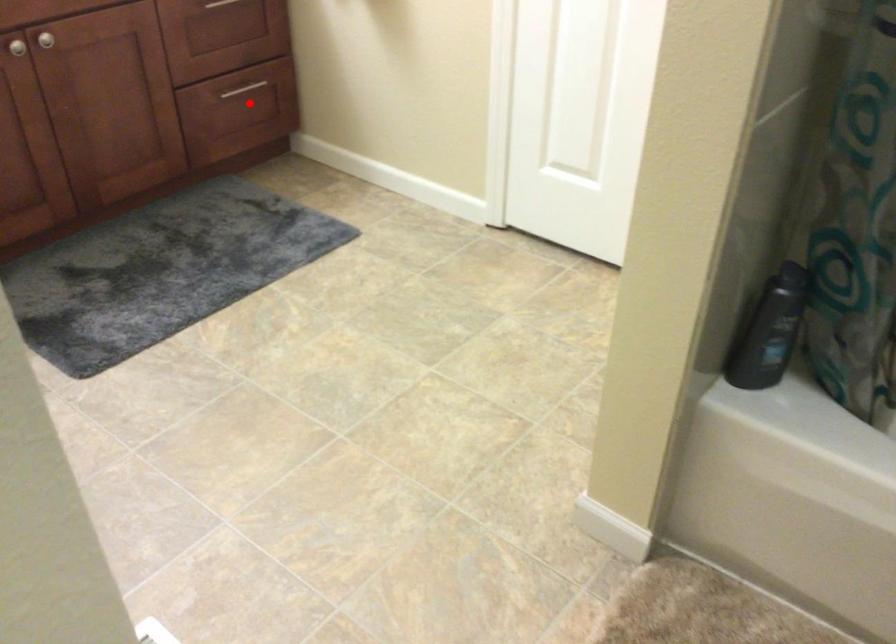
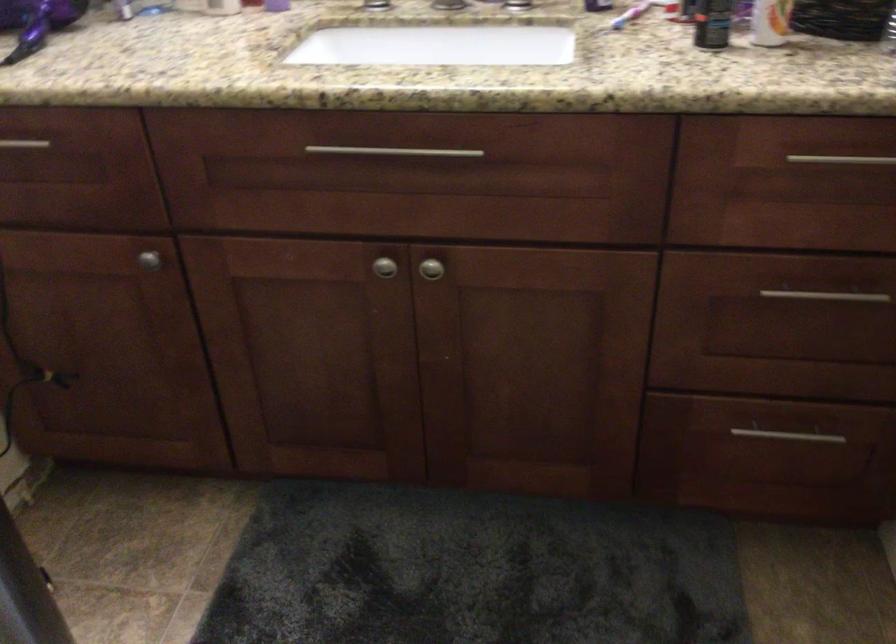
Question: I am providing you with two images of the same scene from different viewpoints. Given a red point in image1, look at the same physical point in image2. Is it:

Choices:
 (A) Closer to the viewpoint
 (B) Farther from the viewpoint

Answer: (A)